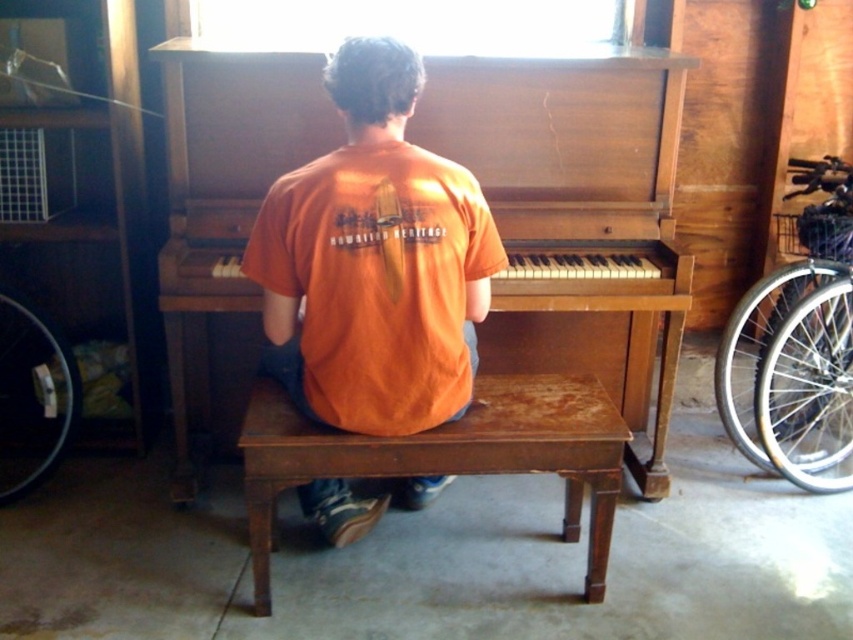
Between wooden piano at center and dark brown wooden stool at center, which one has less height?

With less height is dark brown wooden stool at center.

Who is more distant from viewer, (561,202) or (450,451)?

The point (561,202) is more distant.

You are a GUI agent. You are given a task and a screenshot of the screen. Output one action in this format:
    pyautogui.click(x=<x>, y=<y>)
    Task: Click on the wooden piano at center
    
    Given the screenshot: What is the action you would take?
    pyautogui.click(x=575, y=211)

Is point (349, 72) positioned behind point (519, 397)?

No, it is not.

Does orange matte shirt at center have a greater height compared to dark brown wooden stool at center?

Yes, orange matte shirt at center is taller than dark brown wooden stool at center.

Is point (437, 157) positioned before point (601, 548)?

Yes, it is in front of point (601, 548).

Find the location of `orange matte shirt at center`. orange matte shirt at center is located at coordinates point(374,260).

Does wooden piano at center have a larger size compared to orange matte shirt at center?

Indeed, wooden piano at center has a larger size compared to orange matte shirt at center.

Does wooden piano at center appear on the left side of orange matte shirt at center?

In fact, wooden piano at center is to the right of orange matte shirt at center.

Is point (561, 60) more distant than point (409, 160)?

Yes, it is behind point (409, 160).

Image resolution: width=853 pixels, height=640 pixels. Identify the location of wooden piano at center. pyautogui.click(x=575, y=211).